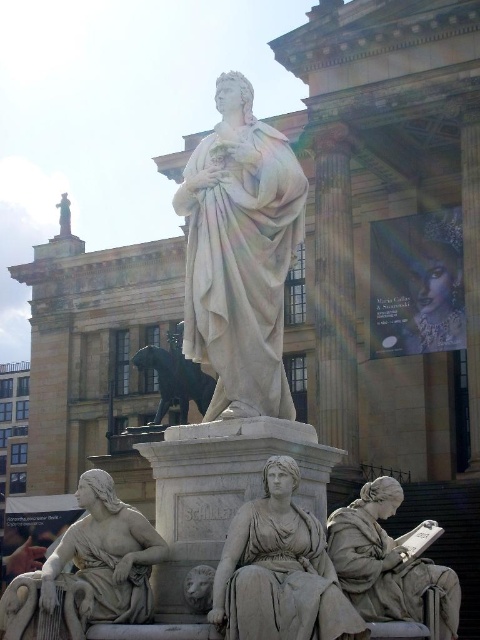
Question: Can you confirm if white marble statue at center is bigger than matte gray statue at lower right?

Choices:
 (A) yes
 (B) no

Answer: (A)

Question: Which is nearer to the matte gray statue at lower right?

Choices:
 (A) matte gray statue at center
 (B) matte white statue at lower left
 (C) matte stone lion at lower center
 (D) white marble statue at center

Answer: (A)

Question: Estimate the real-world distances between objects in this image. Which object is farther from the white marble statue at center?

Choices:
 (A) matte white statue at lower left
 (B) matte gray statue at center
 (C) matte stone lion at lower center
 (D) matte gray statue at lower right

Answer: (A)

Question: Can you confirm if matte gray statue at center is thinner than matte white statue at lower left?

Choices:
 (A) yes
 (B) no

Answer: (B)

Question: Does white marble statue at center appear on the right side of matte gray statue at lower right?

Choices:
 (A) no
 (B) yes

Answer: (A)

Question: Which of these objects is positioned closest to the matte stone lion at lower center?

Choices:
 (A) matte white statue at lower left
 (B) matte gray statue at lower right

Answer: (A)